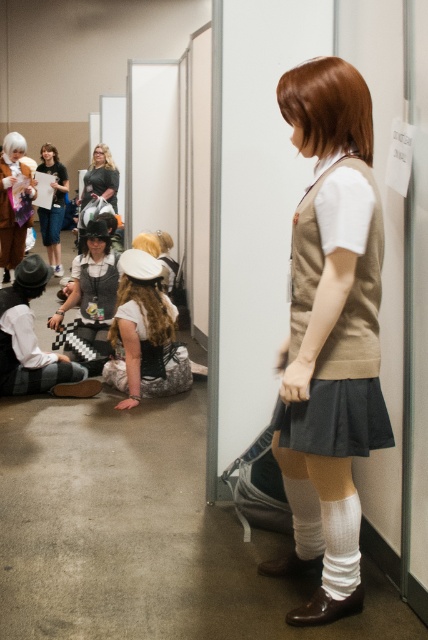
Question: Which object is farther from the camera taking this photo?

Choices:
 (A) white fabric dress at center
 (B) brown leather boot at lower center
 (C) matte black dress at center
 (D) dark gray wool skirt at center

Answer: (C)

Question: Which point is closer to the camera taking this photo?

Choices:
 (A) (165, 296)
 (B) (26, 355)
 (C) (92, 184)

Answer: (B)

Question: Which of these objects is positioned farthest from the matte black hat at lower left?

Choices:
 (A) matte brown vest at center
 (B) matte black dress at center
 (C) dark gray wool skirt at center
 (D) brown leather boot at lower center

Answer: (B)

Question: Is matte brown vest at center below matte black hat at lower left?

Choices:
 (A) no
 (B) yes

Answer: (A)

Question: From the image, what is the correct spatial relationship of matte brown vest at center in relation to matte black hat at lower left?

Choices:
 (A) below
 (B) above

Answer: (B)

Question: Does dark gray wool skirt at center have a smaller size compared to matte black hat at lower left?

Choices:
 (A) yes
 (B) no

Answer: (A)